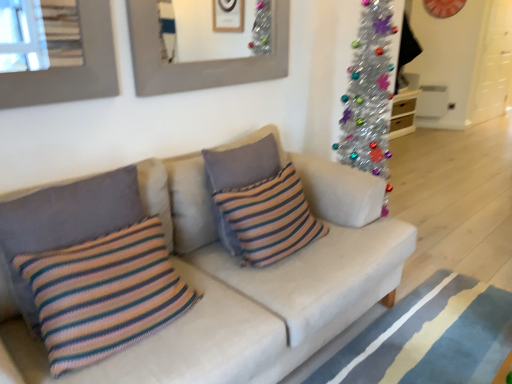
Question: From the image's perspective, is knitted striped pillow at center, marked as the first pillow in a back-to-front arrangement, above matte gray picture frame at upper center?

Choices:
 (A) no
 (B) yes

Answer: (A)

Question: Is knitted striped pillow at center, arranged as the third pillow when viewed from the front, wider than matte gray picture frame at upper center?

Choices:
 (A) yes
 (B) no

Answer: (A)

Question: Can you confirm if knitted striped pillow at center, marked as the first pillow in a back-to-front arrangement, is shorter than matte gray picture frame at upper center?

Choices:
 (A) yes
 (B) no

Answer: (B)

Question: Is knitted striped pillow at center, marked as the first pillow in a back-to-front arrangement, oriented away from matte gray picture frame at upper center?

Choices:
 (A) no
 (B) yes

Answer: (A)

Question: Is knitted striped pillow at center, marked as the first pillow in a back-to-front arrangement, to the left of matte gray picture frame at upper center from the viewer's perspective?

Choices:
 (A) no
 (B) yes

Answer: (A)

Question: Considering the positions of matte gray picture frame at upper center and blue striped rug at lower right in the image, is matte gray picture frame at upper center bigger or smaller than blue striped rug at lower right?

Choices:
 (A) small
 (B) big

Answer: (A)

Question: Would you say matte gray picture frame at upper center is to the left or to the right of blue striped rug at lower right in the picture?

Choices:
 (A) right
 (B) left

Answer: (B)

Question: Is matte gray picture frame at upper center taller or shorter than blue striped rug at lower right?

Choices:
 (A) tall
 (B) short

Answer: (A)

Question: Considering the positions of matte gray picture frame at upper center and blue striped rug at lower right in the image, is matte gray picture frame at upper center wider or thinner than blue striped rug at lower right?

Choices:
 (A) wide
 (B) thin

Answer: (B)

Question: From the image's perspective, is white fabric couch at center above or below knitted multicolored pillow at left, the 2th pillow when ordered from back to front?

Choices:
 (A) below
 (B) above

Answer: (A)

Question: Is white fabric couch at center situated inside knitted multicolored pillow at left, positioned as the second pillow in front-to-back order, or outside?

Choices:
 (A) inside
 (B) outside

Answer: (B)

Question: Is point (157, 208) positioned closer to the camera than point (94, 188)?

Choices:
 (A) farther
 (B) closer

Answer: (A)

Question: In the image, is white fabric couch at center on the left side or the right side of knitted multicolored pillow at left, positioned as the second pillow in front-to-back order?

Choices:
 (A) left
 (B) right

Answer: (B)

Question: Considering the positions of white fabric couch at center and blue striped rug at lower right in the image, is white fabric couch at center taller or shorter than blue striped rug at lower right?

Choices:
 (A) short
 (B) tall

Answer: (B)

Question: Looking at the image, does white fabric couch at center seem bigger or smaller compared to blue striped rug at lower right?

Choices:
 (A) small
 (B) big

Answer: (B)